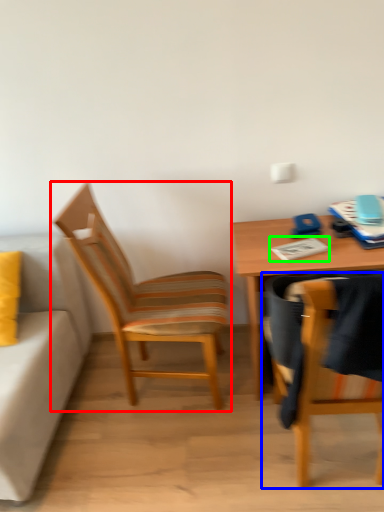
Question: Based on their relative distances, which object is nearer to chair (highlighted by a red box)? Choose from chair (highlighted by a blue box) and notepad (highlighted by a green box).

Choices:
 (A) chair
 (B) notepad

Answer: (B)